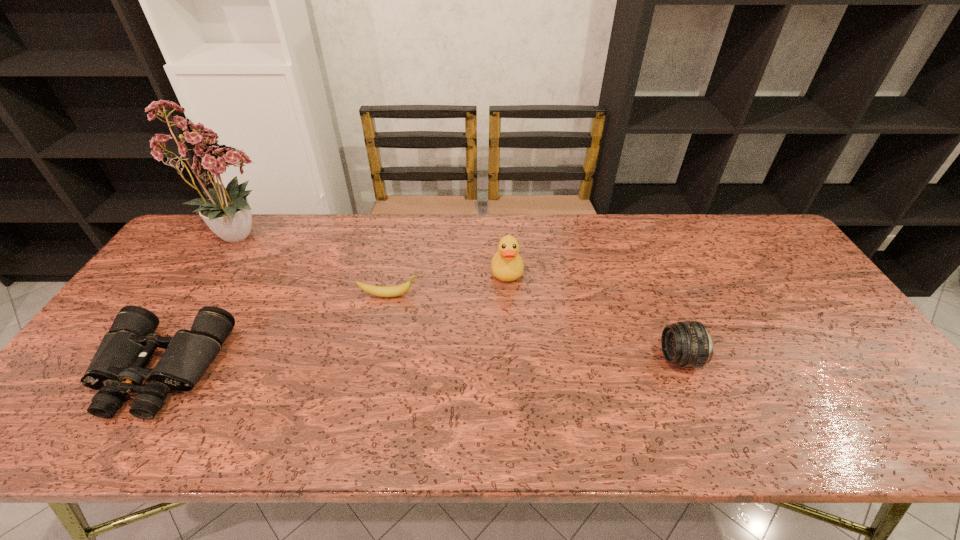
Locate an element on the screen. Image resolution: width=960 pixels, height=540 pixels. vacant space situated 0.130m at the front element of the telephoto lens is located at coordinates click(x=611, y=358).

At what (x,y) coordinates should I click in order to perform the action: click on vacant space located 0.300m at the front element of the telephoto lens. Please return your answer as a coordinate pair (x, y). Looking at the image, I should click on (542, 358).

Identify the location of vacant space located at the front element of the telephoto lens. (570, 358).

At what (x,y) coordinates should I click in order to perform the action: click on vacant space located through the eyepieces of the binoculars. Please return your answer as a coordinate pair (x, y). The width and height of the screenshot is (960, 540). Looking at the image, I should click on (112, 448).

Where is `free space located at the stem of the banana`? The width and height of the screenshot is (960, 540). free space located at the stem of the banana is located at coordinates (445, 295).

At what (x,y) coordinates should I click in order to perform the action: click on flower arrangement positioned at the far edge. Please return your answer as a coordinate pair (x, y). Image resolution: width=960 pixels, height=540 pixels. Looking at the image, I should click on (227, 213).

This screenshot has width=960, height=540. Find the location of `duck present at the far edge`. duck present at the far edge is located at coordinates (507, 265).

Find the location of a particular element. object located in the near edge section of the desktop is located at coordinates (117, 368).

What are the coordinates of `flower arrangement situated at the left edge` in the screenshot? It's located at (227, 213).

At what (x,y) coordinates should I click in order to perform the action: click on binoculars at the left edge. Please return your answer as a coordinate pair (x, y). Image resolution: width=960 pixels, height=540 pixels. Looking at the image, I should click on (117, 368).